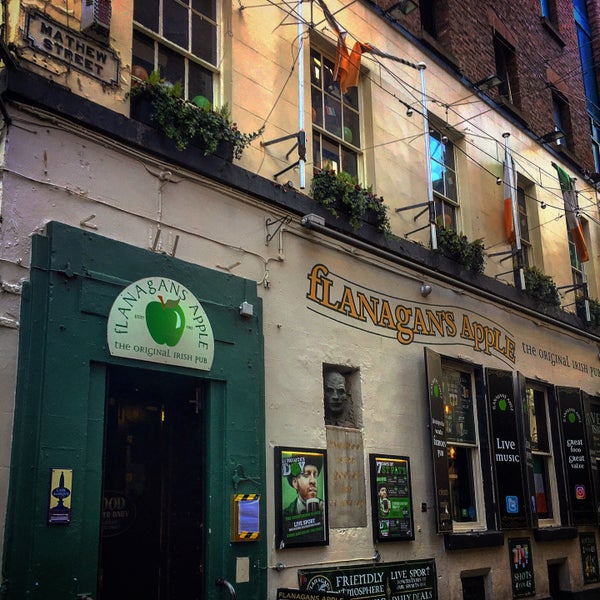
This screenshot has width=600, height=600. I want to click on window, so click(170, 39).